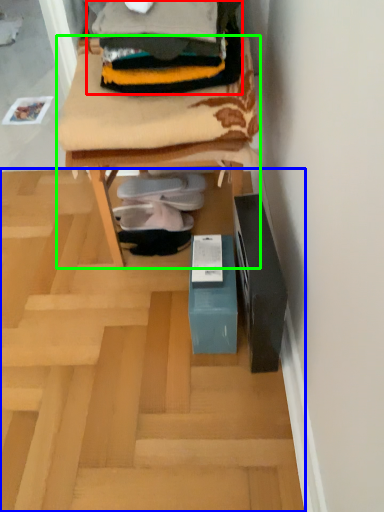
Question: Which is nearer to the clothing (highlighted by a red box)? furnurniture (highlighted by a blue box) or furniture (highlighted by a green box).

Choices:
 (A) furnurniture
 (B) furniture

Answer: (B)